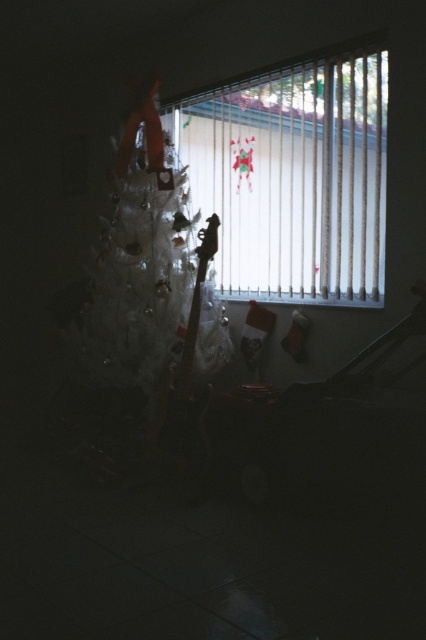
Between white plastic blinds at upper right and white frosted christmas tree at center, which one has more height?

white frosted christmas tree at center

Does white plastic blinds at upper right have a greater width compared to white frosted christmas tree at center?

Yes, white plastic blinds at upper right is wider than white frosted christmas tree at center.

Who is more distant from viewer, (x=377, y=140) or (x=187, y=262)?

Point (x=187, y=262)

The width and height of the screenshot is (426, 640). I want to click on white plastic blinds at upper right, so 293,176.